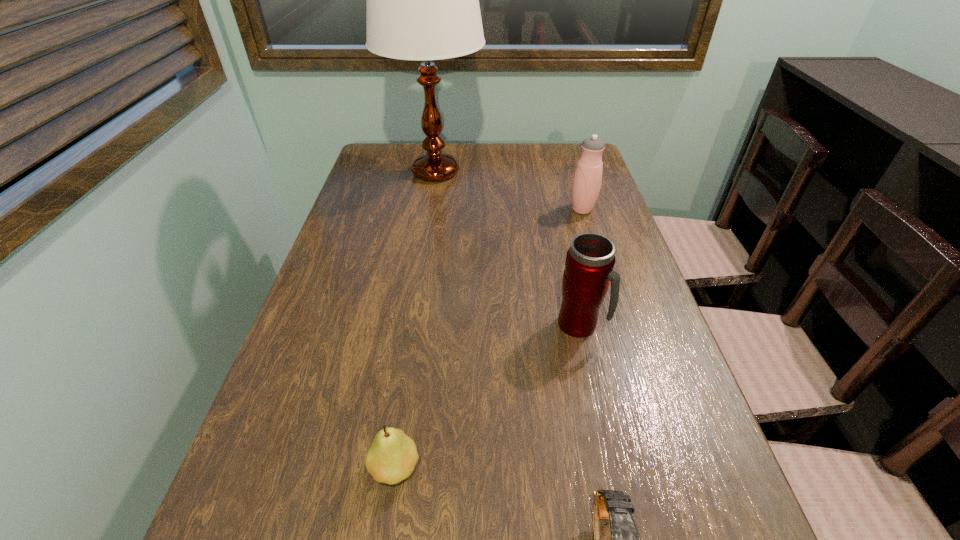
The height and width of the screenshot is (540, 960). Identify the location of object present at the left edge. (422, 0).

Locate an element on the screen. The image size is (960, 540). object located at the far left corner is located at coordinates (422, 0).

I want to click on free space at the far edge of the desktop, so click(460, 157).

Where is `vacant space at the left edge of the desktop`? vacant space at the left edge of the desktop is located at coordinates (402, 182).

Where is `free space at the right edge`? The image size is (960, 540). free space at the right edge is located at coordinates (601, 318).

Where is `blank area at the far left corner`? The image size is (960, 540). blank area at the far left corner is located at coordinates (389, 165).

The height and width of the screenshot is (540, 960). What are the coordinates of `free space between the tallest object and the farther thermos bottle` in the screenshot? It's located at pos(509,191).

This screenshot has height=540, width=960. Find the location of `vacant space in between the table lamp and the pear`. vacant space in between the table lamp and the pear is located at coordinates (416, 320).

The height and width of the screenshot is (540, 960). In order to click on free spot between the pear and the tallest object in this screenshot , I will do `click(416, 320)`.

I want to click on vacant area between the pear and the table lamp, so click(416, 320).